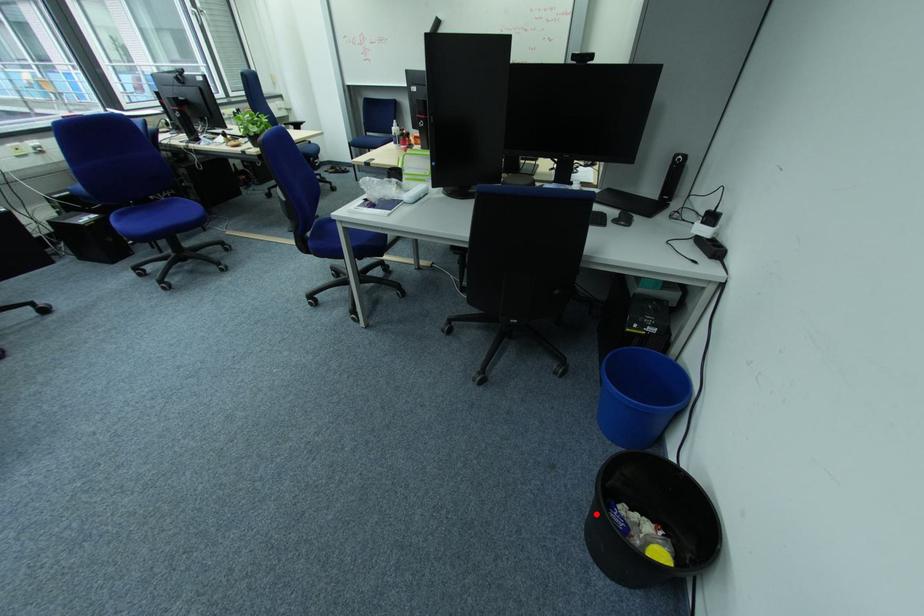
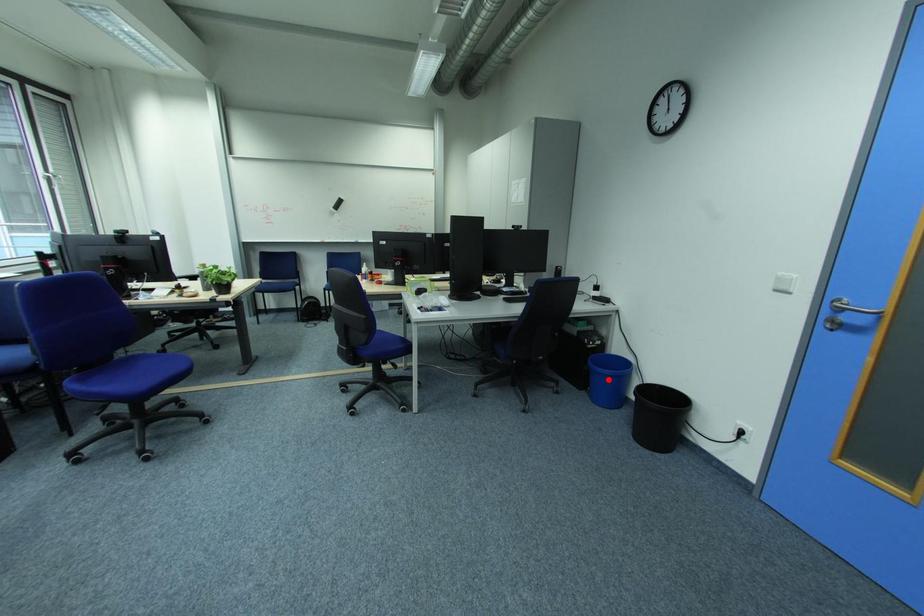
I am providing you with two images of the same scene from different viewpoints. A red point is marked on the first image and another point is marked on the second image. Is the red point in image1 aligned with the point shown in image2?

No